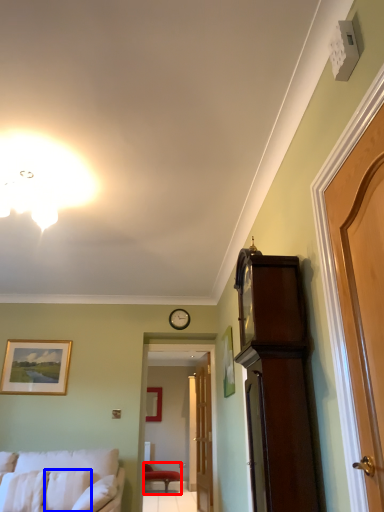
Question: Which point is closer to the camera, chair (highlighted by a red box) or pillow (highlighted by a blue box)?

Choices:
 (A) chair
 (B) pillow

Answer: (B)